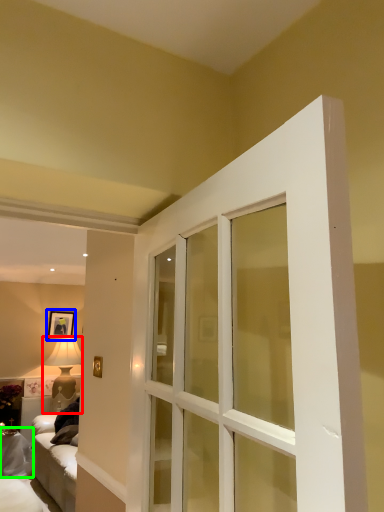
Question: Which object is positioned closest to lamp (highlighted by a red box)? Select from picture frame (highlighted by a blue box) and furniture (highlighted by a green box).

Choices:
 (A) picture frame
 (B) furniture

Answer: (A)